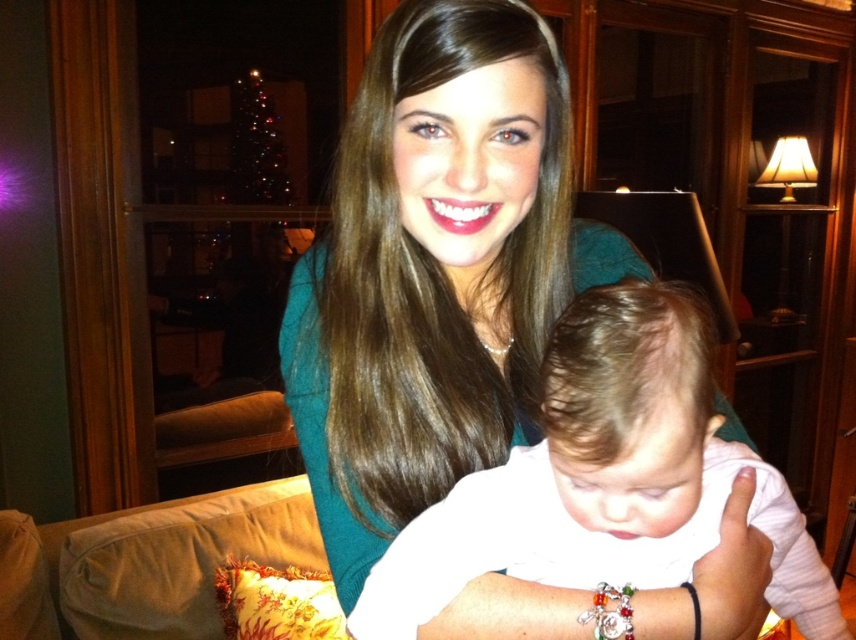
You are a photographer trying to capture a closeup of the baby in the scene. You need to ensure that both the matte teal sweater at center and the white soft baby at center are in focus. Given that the depth of field can only sharply focus on one object at a time, which object should you focus on to ensure the baby is recognizable?

The matte teal sweater at center has a larger size compared to the white soft baby at center. To ensure the baby is recognizable, you should focus on the white soft baby at center since it is smaller and requires more detailed focus for its features to be clear.

You are an interior designer analyzing the placement of objects in the scene. The matte teal sweater at center is part of a proposed design layout. If the room has a coordinate system where the bottom left corner is the origin, can you confirm whether the sweater is placed closer to the center of the room or near the edges?

The position of matte teal sweater at center is at point (435, 269), which is very close to the center coordinates of the room, so it is placed near the center of the room.

You are a photographer setting up a shoot in this living room. You need to ensure that the matte teal sweater at center and the white soft baby at center are both visible in the frame. Based on their positions, which object is closer to the camera?

The matte teal sweater at center is above the white soft baby at center, so it is closer to the camera.